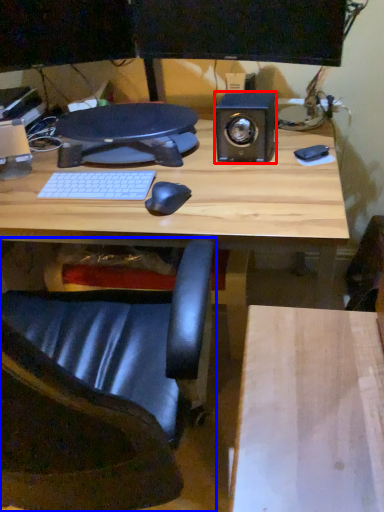
Question: Which of the following is the farthest to the observer, speaker (highlighted by a red box) or chair (highlighted by a blue box)?

Choices:
 (A) speaker
 (B) chair

Answer: (A)